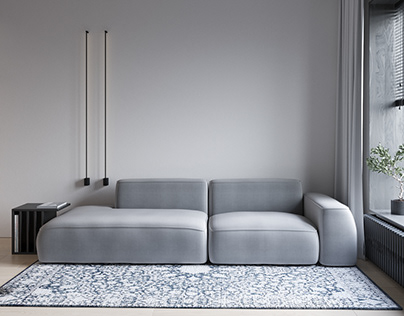
Identify the location of heat radiator. (382, 245).